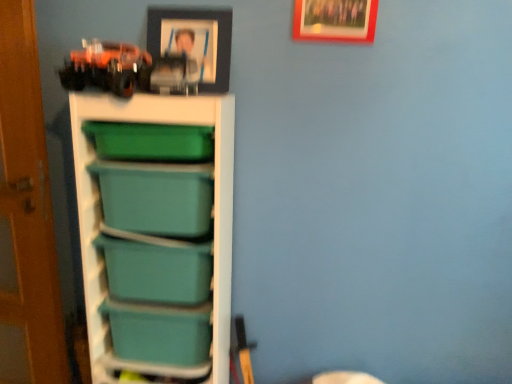
Question: Based on their positions, is teal plastic storage bin at center, placed as the first box when sorted from bottom to top, located to the left or right of teal plastic storage at left?

Choices:
 (A) left
 (B) right

Answer: (A)

Question: Considering the positions of teal plastic storage bin at center, the 2th box in the top-to-bottom sequence, and teal plastic storage at left in the image, is teal plastic storage bin at center, the 2th box in the top-to-bottom sequence, bigger or smaller than teal plastic storage at left?

Choices:
 (A) small
 (B) big

Answer: (A)

Question: Which object is positioned farthest from the teal plastic storage bin at center, marked as the 1th box in a top-to-bottom arrangement?

Choices:
 (A) wooden picture frame at upper center, which ranks as the first picture frame in right-to-left order
 (B) teal plastic storage at left
 (C) matte black picture frame at upper center, the 1th picture frame in the left-to-right sequence
 (D) teal plastic storage bin at center, placed as the first box when sorted from bottom to top

Answer: (A)

Question: Based on their relative distances, which object is farther from the teal plastic storage at left?

Choices:
 (A) teal plastic storage bin at center, which is the 2th box in bottom-to-top order
 (B) wooden picture frame at upper center, which ranks as the first picture frame in right-to-left order
 (C) matte black picture frame at upper center, arranged as the second picture frame when viewed from the right
 (D) teal plastic storage bin at center, placed as the first box when sorted from bottom to top

Answer: (B)